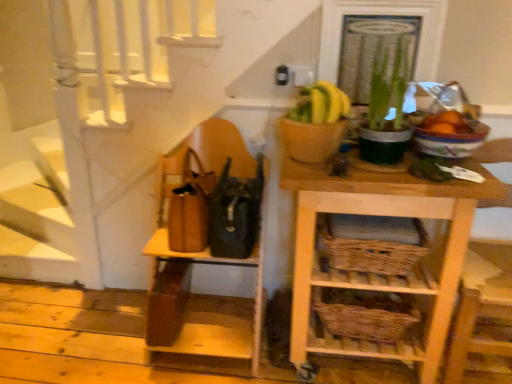
I want to click on vacant area situated to the left side of brown leather shelf at left, the 2th shelf from the right, so click(x=102, y=336).